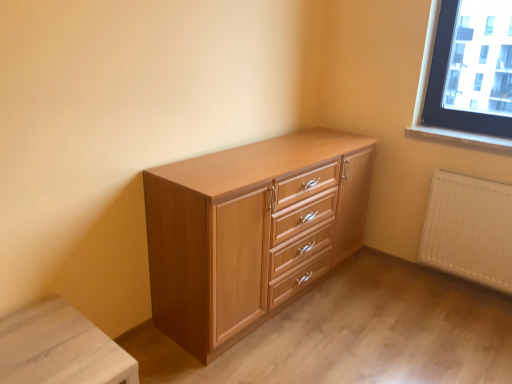
Where is `free space above light brown wood chest of drawers at center (from a real-world perspective)`? The height and width of the screenshot is (384, 512). free space above light brown wood chest of drawers at center (from a real-world perspective) is located at coordinates (247, 162).